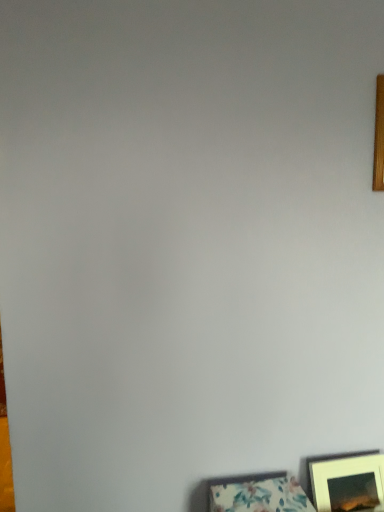
Question: Does wooden frame at upper right, which is the first picture frame from right to left, have a greater width compared to matte white picture frame at lower right, which ranks as the 2th picture frame in left-to-right order?

Choices:
 (A) no
 (B) yes

Answer: (A)

Question: Is wooden frame at upper right, which appears as the 1th picture frame when viewed from the top, to the left of matte white picture frame at lower right, which ranks as the 2th picture frame in left-to-right order, from the viewer's perspective?

Choices:
 (A) no
 (B) yes

Answer: (A)

Question: Is wooden frame at upper right, the 3th picture frame positioned from the left, oriented towards matte white picture frame at lower right, marked as the 2th picture frame in a bottom-to-top arrangement?

Choices:
 (A) yes
 (B) no

Answer: (B)

Question: Does wooden frame at upper right, positioned as the third picture frame in bottom-to-top order, have a greater height compared to matte white picture frame at lower right, the 2th picture frame viewed from the top?

Choices:
 (A) no
 (B) yes

Answer: (B)

Question: Can you confirm if wooden frame at upper right, the 3th picture frame positioned from the left, is thinner than matte white picture frame at lower right, the 2th picture frame viewed from the top?

Choices:
 (A) no
 (B) yes

Answer: (B)

Question: From a real-world perspective, is wooden frame at upper right, which is the first picture frame from right to left, physically above matte white picture frame at lower right, which ranks as the 2th picture frame in left-to-right order?

Choices:
 (A) no
 (B) yes

Answer: (B)

Question: From the image's perspective, does floral fabric picture frame at lower right, which is the first picture frame in left-to-right order, appear higher than wooden frame at upper right, which appears as the 1th picture frame when viewed from the top?

Choices:
 (A) yes
 (B) no

Answer: (B)

Question: From the image's perspective, is floral fabric picture frame at lower right, placed as the 3th picture frame when sorted from top to bottom, beneath wooden frame at upper right, which appears as the 1th picture frame when viewed from the top?

Choices:
 (A) yes
 (B) no

Answer: (A)

Question: Are floral fabric picture frame at lower right, positioned as the 1th picture frame in bottom-to-top order, and wooden frame at upper right, positioned as the third picture frame in bottom-to-top order, located far from each other?

Choices:
 (A) no
 (B) yes

Answer: (A)

Question: Does floral fabric picture frame at lower right, placed as the 3th picture frame when sorted from top to bottom, lie behind wooden frame at upper right, positioned as the third picture frame in bottom-to-top order?

Choices:
 (A) no
 (B) yes

Answer: (A)

Question: Can you confirm if floral fabric picture frame at lower right, the third picture frame when ordered from right to left, is positioned to the left of wooden frame at upper right, which appears as the 1th picture frame when viewed from the top?

Choices:
 (A) yes
 (B) no

Answer: (A)

Question: Can you confirm if floral fabric picture frame at lower right, which is the first picture frame in left-to-right order, is taller than wooden frame at upper right, the 3th picture frame positioned from the left?

Choices:
 (A) yes
 (B) no

Answer: (B)

Question: Is wooden frame at upper right, the 3th picture frame positioned from the left, positioned with its back to floral fabric picture frame at lower right, the third picture frame when ordered from right to left?

Choices:
 (A) yes
 (B) no

Answer: (B)